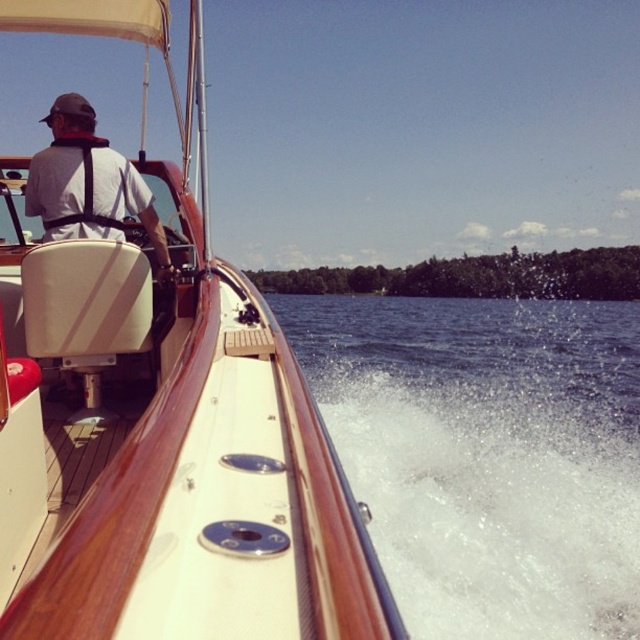
Question: Is wooden polished boat at center below white frothy water at lower right?

Choices:
 (A) yes
 (B) no

Answer: (A)

Question: Is white frothy water at lower right in front of matte black harness at center?

Choices:
 (A) no
 (B) yes

Answer: (B)

Question: Which of the following is the closest to the observer?

Choices:
 (A) matte black harness at center
 (B) white frothy water at lower right
 (C) wooden polished boat at center

Answer: (C)

Question: Which point is closer to the camera?

Choices:
 (A) white frothy water at lower right
 (B) matte black harness at center
 (C) wooden polished boat at center

Answer: (C)

Question: Can you confirm if white frothy water at lower right is positioned below matte black harness at center?

Choices:
 (A) no
 (B) yes

Answer: (B)

Question: Which object appears farthest from the camera in this image?

Choices:
 (A) white frothy water at lower right
 (B) matte black harness at center
 (C) wooden polished boat at center

Answer: (B)